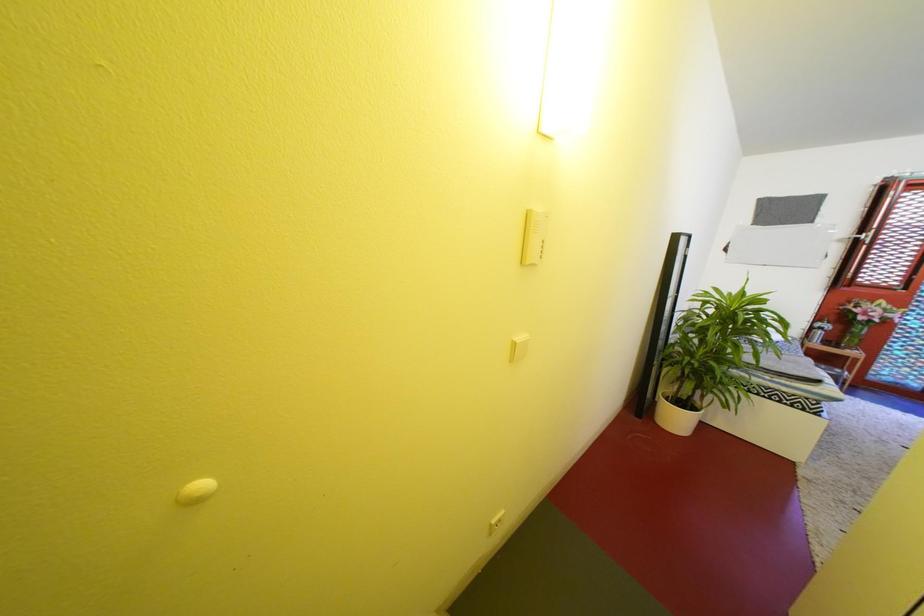
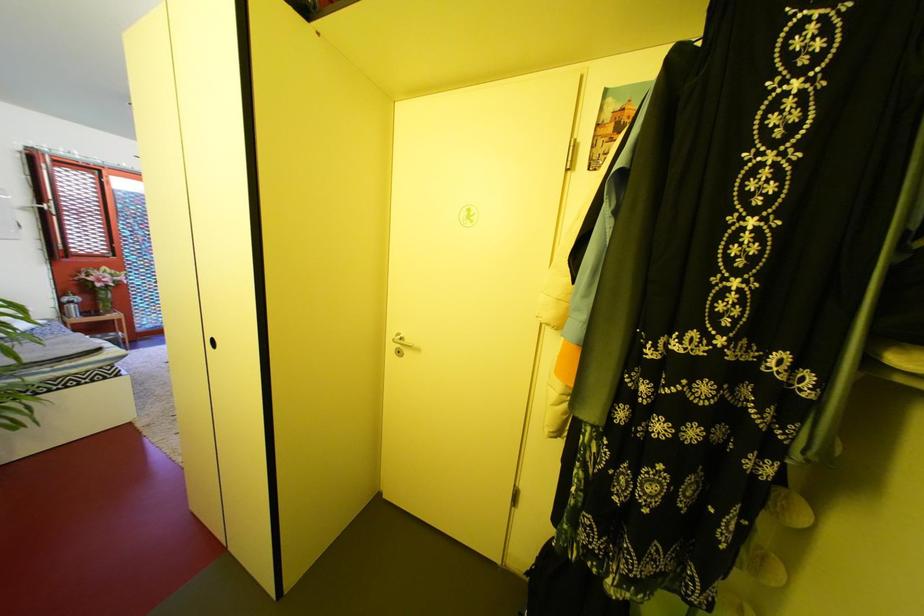
The first image is from the beginning of the video and the second image is from the end. How did the camera likely rotate when shooting the video?

The camera rotated toward right-down.